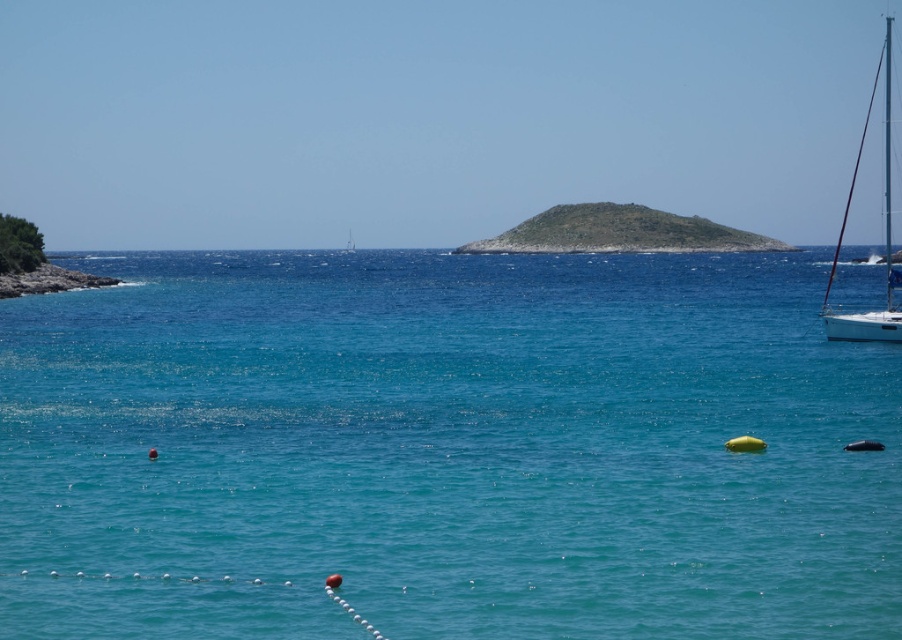
Question: Is clear blue water at center wider than green grassy island at center?

Choices:
 (A) no
 (B) yes

Answer: (B)

Question: Estimate the real-world distances between objects in this image. Which object is farther from the white glossy sailboat at right?

Choices:
 (A) green grassy island at center
 (B) smooth stone cliff at lower left
 (C) clear blue water at center

Answer: (B)

Question: Can you confirm if clear blue water at center is bigger than white glossy sailboat at right?

Choices:
 (A) yes
 (B) no

Answer: (B)

Question: Does white glossy sailboat at right appear under smooth stone cliff at lower left?

Choices:
 (A) no
 (B) yes

Answer: (A)

Question: Which object is farther from the camera taking this photo?

Choices:
 (A) clear blue water at center
 (B) green grassy island at center
 (C) smooth stone cliff at lower left
 (D) white glossy sailboat at right

Answer: (B)

Question: Which point is farther to the camera?

Choices:
 (A) (47, 269)
 (B) (569, 333)

Answer: (A)